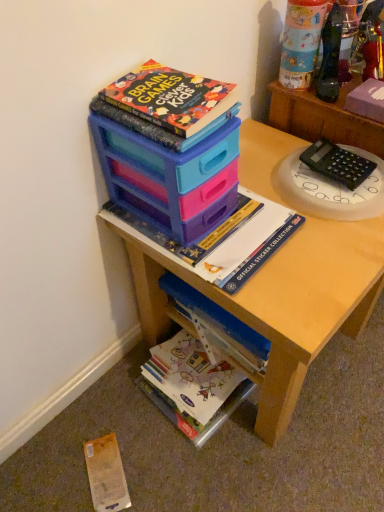
The image size is (384, 512). Identify the location of unoccupied region to the right of yellow paper at lower left. (159, 463).